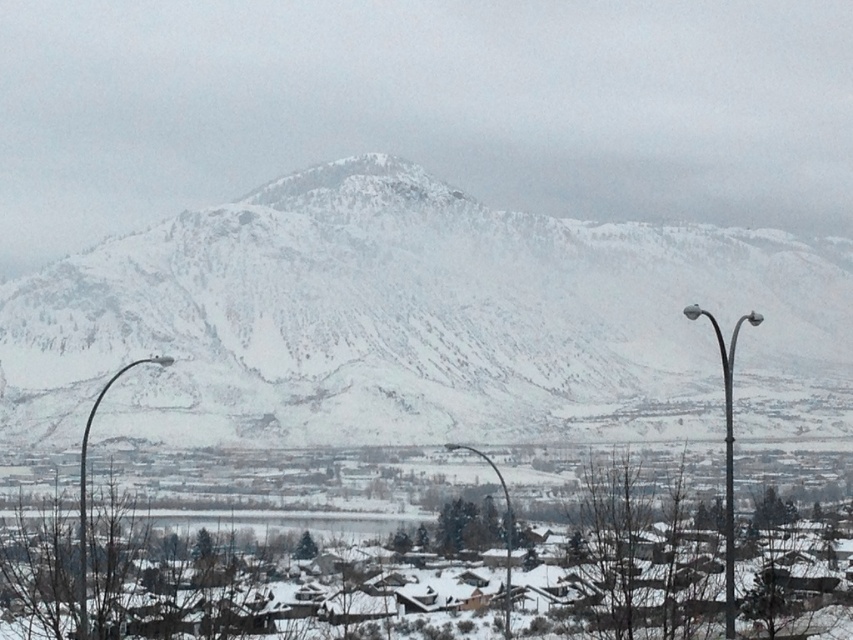
You are a visitor in the winter scene and want to know which metal structure is taller between the metallic curved pole at left and the glossy metal streetlight at lower center. Can you tell me?

The metallic curved pole at left is taller than the glossy metal streetlight at lower center.

You are standing in the snowy village and want to walk from the metallic curved pole at left to the glossy metal streetlight at lower center. Which direction should you head to reach the streetlight?

The metallic curved pole at left is positioned over the glossy metal streetlight at lower center, so you should head downward to reach the streetlight.